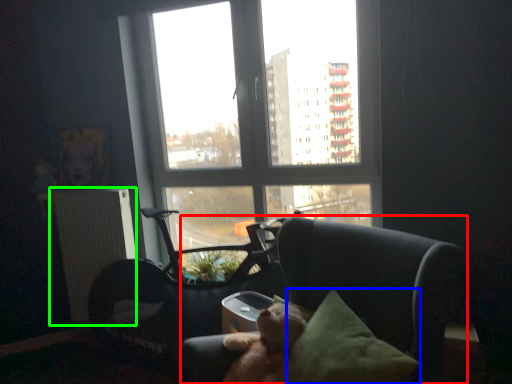
Question: Considering the real-world distances, which object is farthest from chair (highlighted by a red box)? pillow (highlighted by a blue box) or radiator (highlighted by a green box)?

Choices:
 (A) pillow
 (B) radiator

Answer: (B)